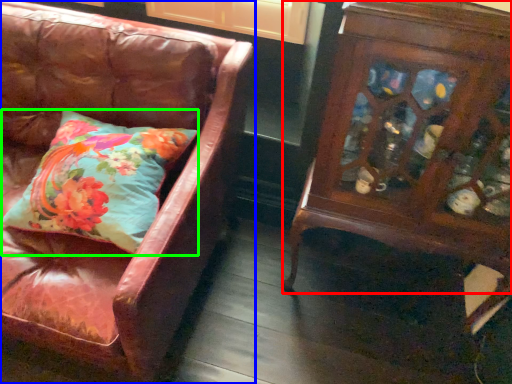
Question: Which is farther away from furniture (highlighted by a red box)? chair (highlighted by a blue box) or pillow (highlighted by a green box)?

Choices:
 (A) chair
 (B) pillow

Answer: (B)